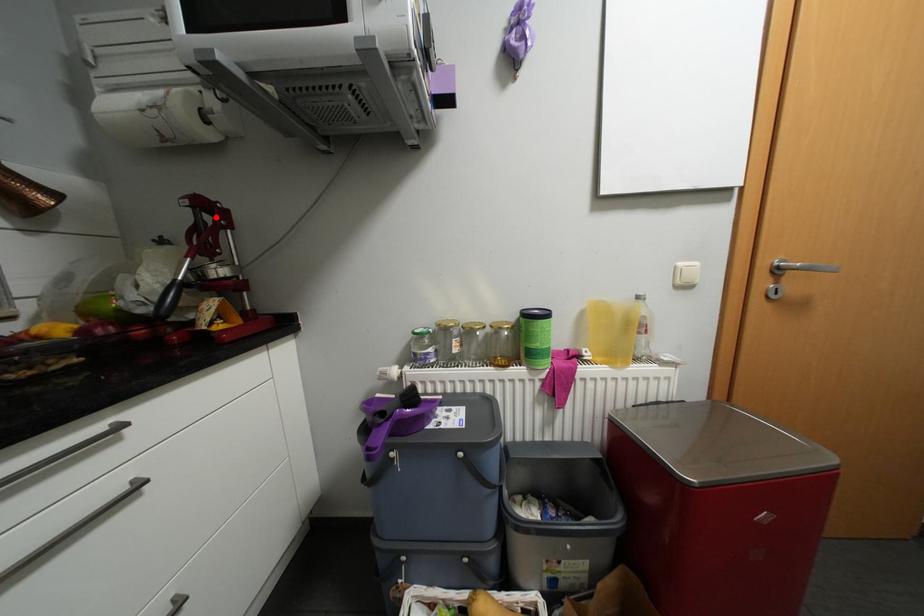
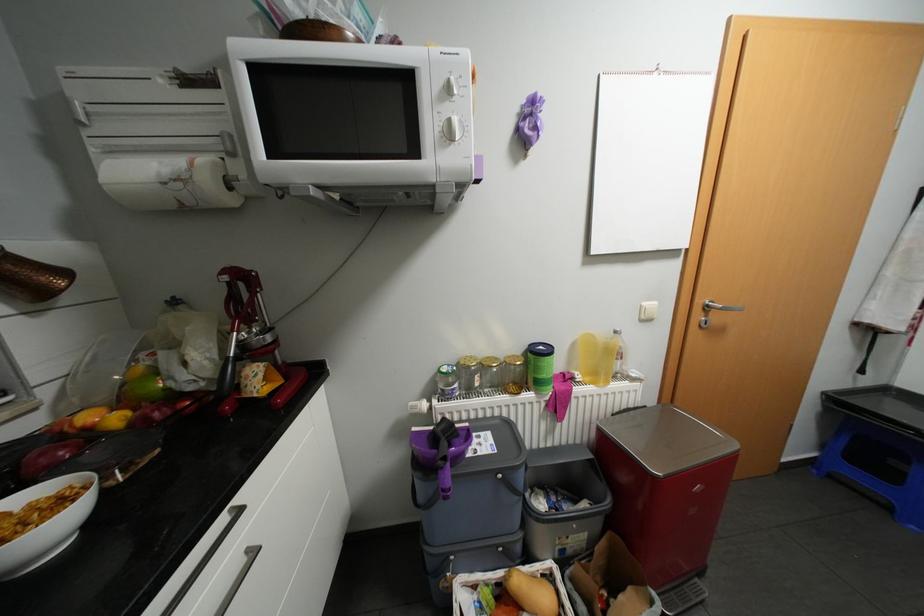
Question: I am providing you with two images of the same scene from different viewpoints. A red point is marked on the first image. Is the red point's position out of view in image 2?

Choices:
 (A) Yes
 (B) No

Answer: (B)